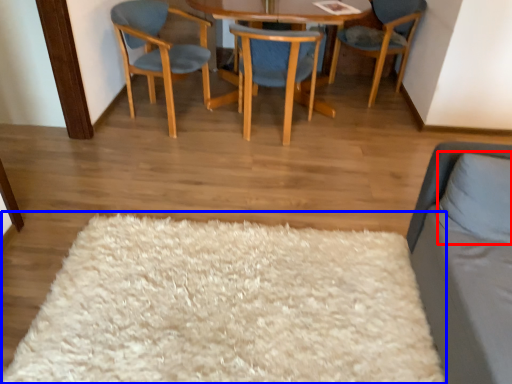
Question: Which of the following is the farthest to the observer, pillow (highlighted by a red box) or mat (highlighted by a blue box)?

Choices:
 (A) pillow
 (B) mat

Answer: (A)